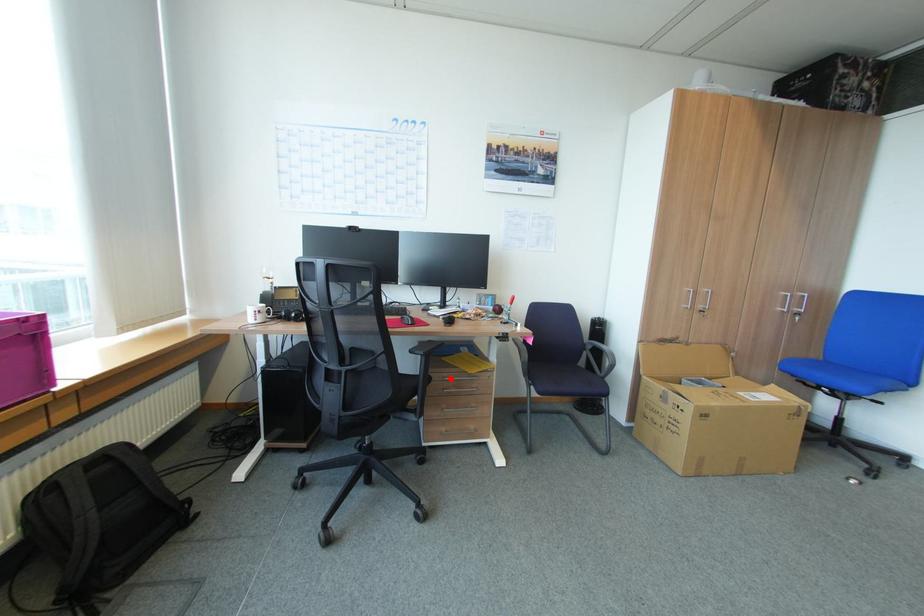
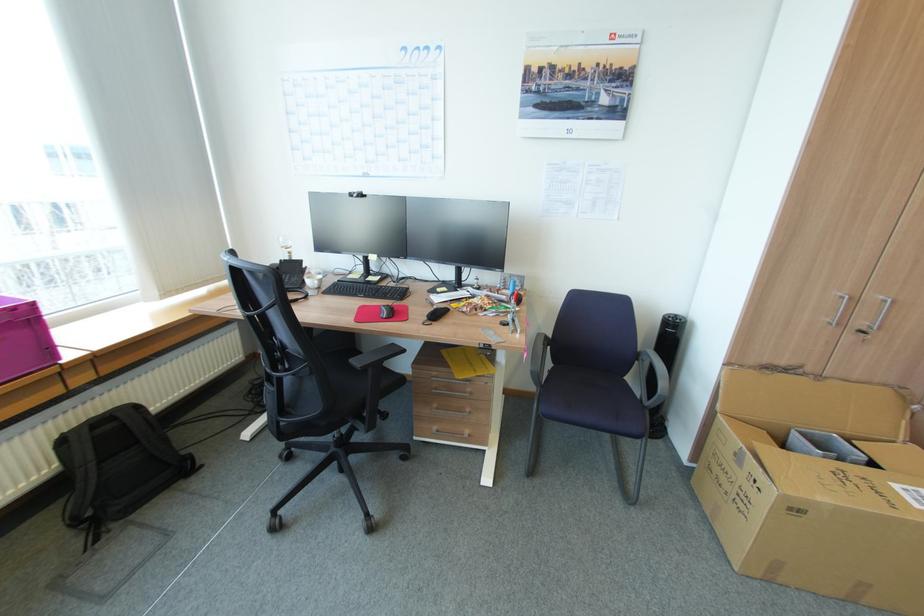
Where in the second image is the point corresponding to the highlighted location from the first image?

(438, 378)